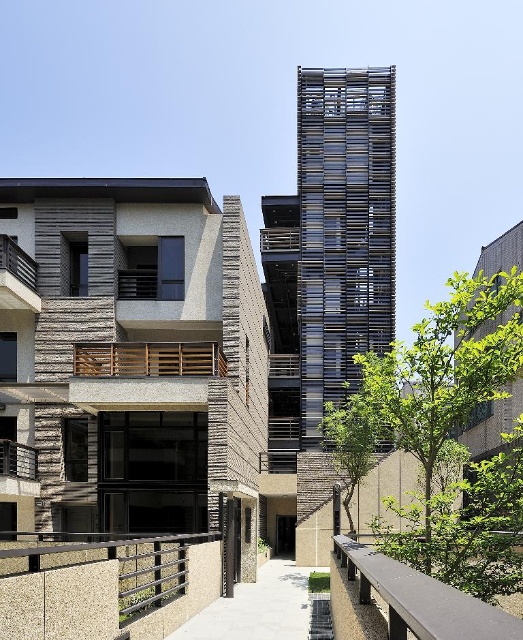
You are standing in the architectural scene and want to determine which of the two points, point (122, 568) or point (31, 275), is closer to you. Based on the scene description, which point is nearer?

Point (122, 568) is closer to the viewer than point (31, 275).

What is the 2D coordinate of the metallic textured railing at lower center in the image?

The metallic textured railing at lower center is located at the 2D coordinate point of (x=118, y=564).

You are a maintenance worker inspecting the building structure. You notice the metallic textured railing at lower center and the wooden slats at center. Which object is located below the other?

The metallic textured railing at lower center is positioned under the wooden slats at center.